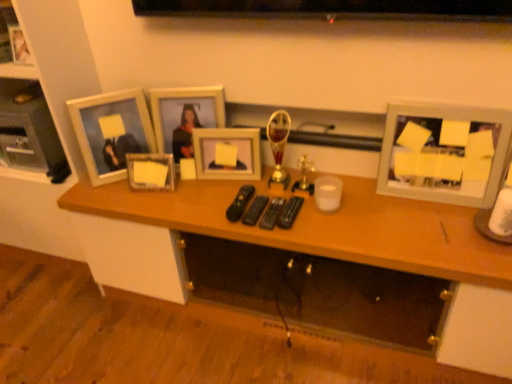
Where is `unoccupied area in front of black plastic remote control at center, placed as the fourth remote control when sorted from left to right`? unoccupied area in front of black plastic remote control at center, placed as the fourth remote control when sorted from left to right is located at coordinates (308, 232).